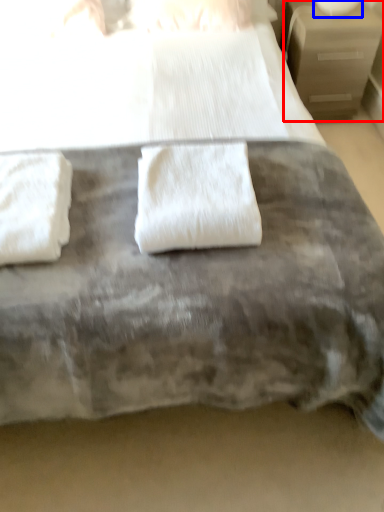
Question: Among these objects, which one is farthest to the camera, nightstand (highlighted by a red box) or table lamp (highlighted by a blue box)?

Choices:
 (A) nightstand
 (B) table lamp

Answer: (B)